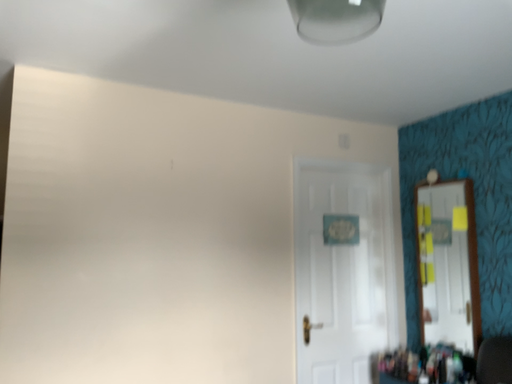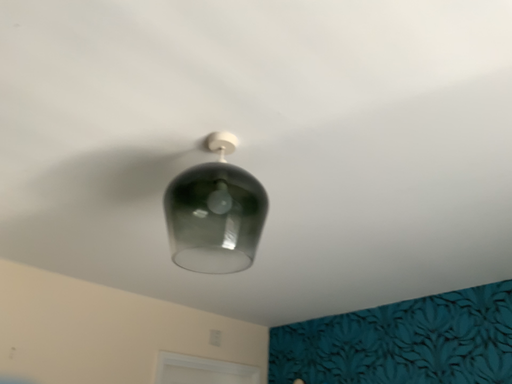
Question: How did the camera likely rotate when shooting the video?

Choices:
 (A) rotated upward
 (B) rotated downward

Answer: (A)